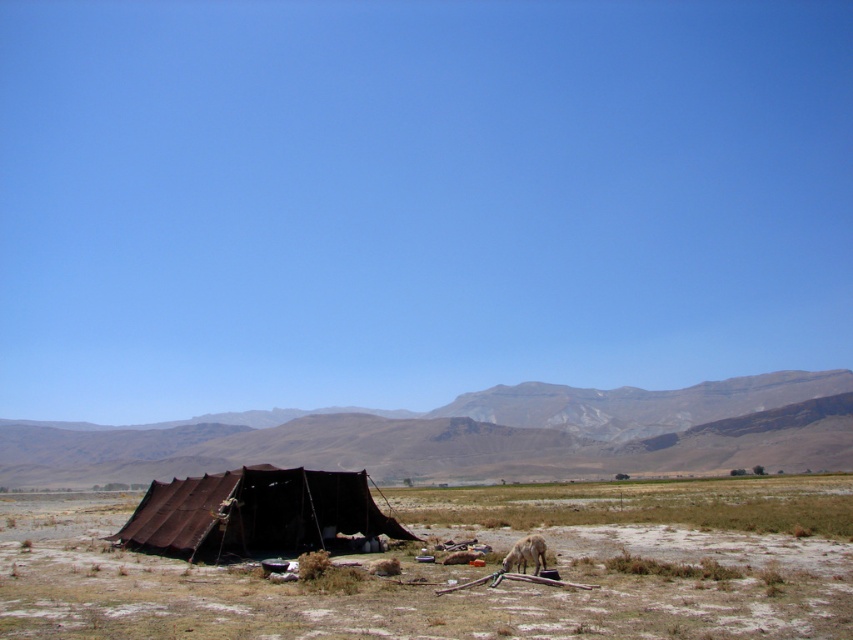
Who is taller, brown canvas tent at center or white woolen goat at lower center?

brown canvas tent at center

Which is more to the right, brown canvas tent at center or white woolen goat at lower center?

From the viewer's perspective, white woolen goat at lower center appears more on the right side.

Locate an element on the screen. The image size is (853, 640). brown canvas tent at center is located at coordinates (254, 513).

Does point (608, 586) lie in front of point (252, 452)?

Yes, point (608, 586) is in front of point (252, 452).

Is brown fabric tent at lower left smaller than brown rocky mountain at center?

Indeed, brown fabric tent at lower left has a smaller size compared to brown rocky mountain at center.

Does point (10, 531) come closer to viewer compared to point (331, 413)?

Yes, it is in front of point (331, 413).

Identify the location of brown fabric tent at lower left. (463, 568).

Which is more to the left, brown rocky mountain at center or white woolen goat at lower center?

Positioned to the left is brown rocky mountain at center.

Between point (216, 467) and point (520, 563), which one is positioned behind?

Positioned behind is point (216, 467).

The width and height of the screenshot is (853, 640). Find the location of `brown rocky mountain at center`. brown rocky mountain at center is located at coordinates (474, 435).